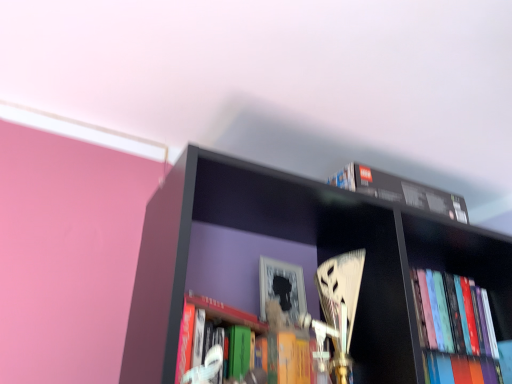
Question: Is black matte book at upper right, which is the 2th book in bottom-to-top order, at the right side of hardcover books at right, which ranks as the 2th book in top-to-bottom order?

Choices:
 (A) yes
 (B) no

Answer: (B)

Question: Is black matte book at upper right, which is the 2th book in bottom-to-top order, positioned with its back to hardcover books at right, which ranks as the 2th book in top-to-bottom order?

Choices:
 (A) no
 (B) yes

Answer: (A)

Question: Does black matte book at upper right, the first book when ordered from top to bottom, have a lesser height compared to hardcover books at right, which ranks as the 2th book in top-to-bottom order?

Choices:
 (A) no
 (B) yes

Answer: (B)

Question: Is black matte book at upper right, the first book when ordered from top to bottom, facing towards hardcover books at right, positioned as the 1th book in bottom-to-top order?

Choices:
 (A) yes
 (B) no

Answer: (B)

Question: Does black matte book at upper right, which is the 2th book in bottom-to-top order, have a greater width compared to hardcover books at right, which ranks as the 2th book in top-to-bottom order?

Choices:
 (A) no
 (B) yes

Answer: (A)

Question: Is black matte book at upper right, which is the 2th book in bottom-to-top order, thinner than hardcover books at right, which ranks as the 2th book in top-to-bottom order?

Choices:
 (A) yes
 (B) no

Answer: (A)

Question: Is hardcover books at right, which ranks as the 2th book in top-to-bottom order, at the right side of black matte book at upper right, the first book when ordered from top to bottom?

Choices:
 (A) no
 (B) yes

Answer: (B)

Question: Is hardcover books at right, which ranks as the 2th book in top-to-bottom order, turned away from black matte book at upper right, the first book when ordered from top to bottom?

Choices:
 (A) no
 (B) yes

Answer: (A)

Question: Is hardcover books at right, positioned as the 1th book in bottom-to-top order, placed right next to black matte book at upper right, the first book when ordered from top to bottom?

Choices:
 (A) yes
 (B) no

Answer: (B)

Question: Can we say hardcover books at right, positioned as the 1th book in bottom-to-top order, lies outside black matte book at upper right, which is the 2th book in bottom-to-top order?

Choices:
 (A) no
 (B) yes

Answer: (B)

Question: From a real-world perspective, does hardcover books at right, positioned as the 1th book in bottom-to-top order, sit lower than black matte book at upper right, which is the 2th book in bottom-to-top order?

Choices:
 (A) no
 (B) yes

Answer: (B)

Question: Looking at the image, does hardcover books at right, positioned as the 1th book in bottom-to-top order, seem bigger or smaller compared to black matte book at upper right, which is the 2th book in bottom-to-top order?

Choices:
 (A) big
 (B) small

Answer: (A)